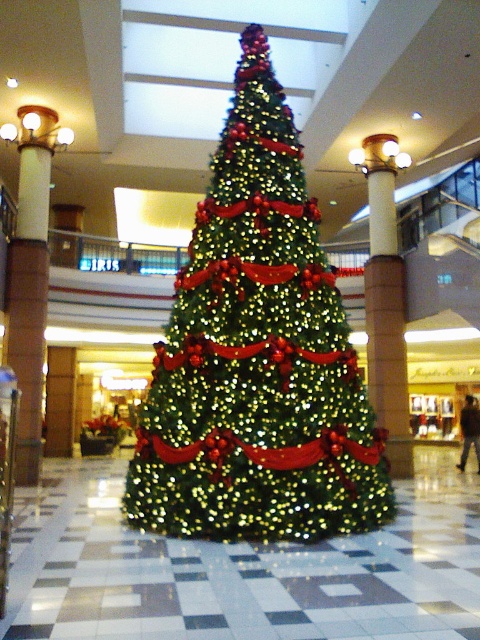
Is green matte christmas tree at center to the right of green shiny christmas tree at center from the viewer's perspective?

In fact, green matte christmas tree at center is to the left of green shiny christmas tree at center.

Between green matte christmas tree at center and green shiny christmas tree at center, which one is positioned higher?

green matte christmas tree at center is higher up.

The height and width of the screenshot is (640, 480). In order to click on green matte christmas tree at center in this screenshot , I will do `click(256, 356)`.